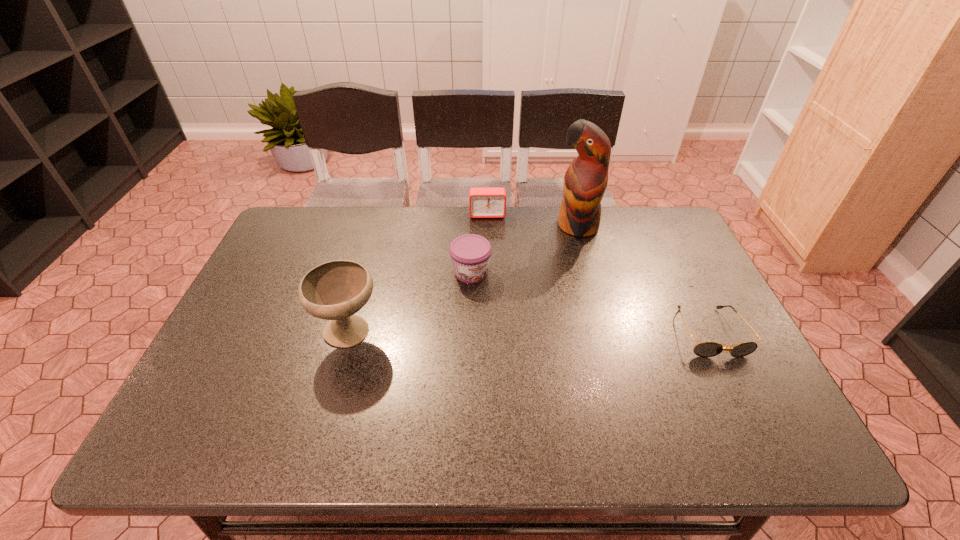
The image size is (960, 540). What are the coordinates of `vacant space that satisfies the following two spatial constraints: 1. on the back side of the third nearest object; 2. on the right side of the alarm clock` in the screenshot? It's located at (472, 214).